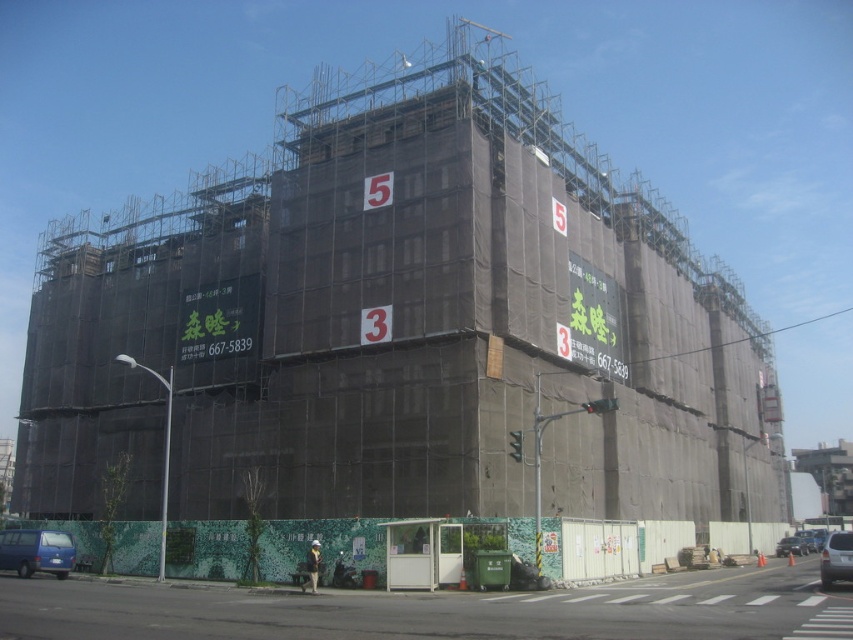
Question: Which object appears farthest from the camera in this image?

Choices:
 (A) metallic blue car at lower right
 (B) green textured wall at lower center
 (C) silver metallic car at lower right
 (D) blue matte van at lower left

Answer: (A)

Question: Can you confirm if silver metallic car at lower right is bigger than metallic blue car at lower right?

Choices:
 (A) no
 (B) yes

Answer: (B)

Question: Is blue matte van at lower left further to camera compared to silver metallic car at lower right?

Choices:
 (A) no
 (B) yes

Answer: (B)

Question: Considering the real-world distances, which object is closest to the metallic blue car at lower right?

Choices:
 (A) green textured wall at lower center
 (B) silver metallic car at lower right

Answer: (B)

Question: Which point is closer to the camera taking this photo?

Choices:
 (A) (323, 628)
 (B) (840, 552)
 (C) (798, 548)

Answer: (A)

Question: Can you confirm if green textured wall at lower center is thinner than metallic blue car at lower right?

Choices:
 (A) no
 (B) yes

Answer: (A)